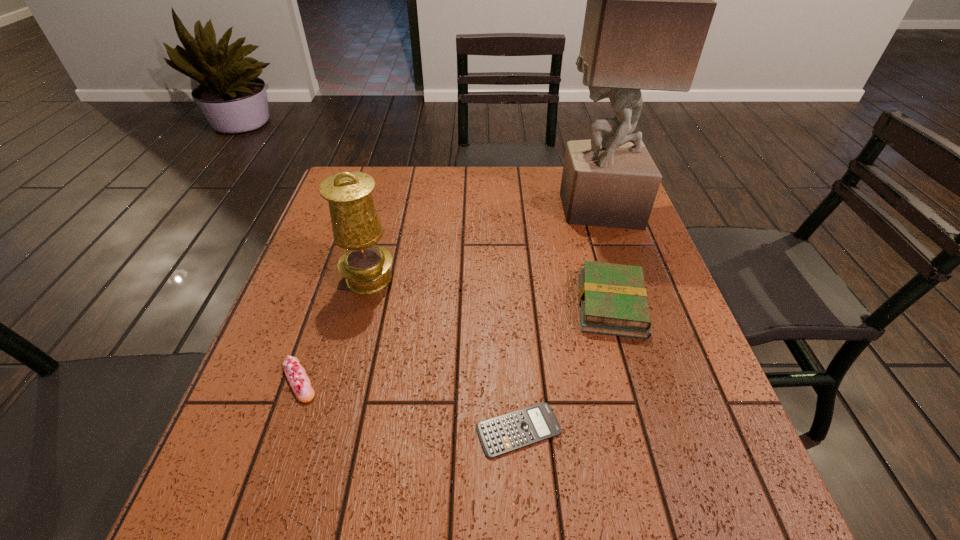
Find the location of a particular element. The width and height of the screenshot is (960, 540). sculpture is located at coordinates coord(650,5).

Where is `the farthest object`? This screenshot has height=540, width=960. the farthest object is located at coordinates (650, 5).

Image resolution: width=960 pixels, height=540 pixels. Identify the location of oil lamp. (356, 226).

The height and width of the screenshot is (540, 960). What are the coordinates of `the third tallest object` in the screenshot? It's located at (613, 300).

You are a GUI agent. You are given a task and a screenshot of the screen. Output one action in this format:
    pyautogui.click(x=<x>, y=<y>)
    Task: Click on the eclair
    
    Given the screenshot: What is the action you would take?
    pyautogui.click(x=300, y=383)

Find the location of a particular element. The width and height of the screenshot is (960, 540). the third object from left to right is located at coordinates (518, 429).

You are a GUI agent. You are given a task and a screenshot of the screen. Output one action in this format:
    pyautogui.click(x=<x>, y=<y>)
    Task: Click on the calculator
    
    Given the screenshot: What is the action you would take?
    pyautogui.click(x=518, y=429)

Identify the location of vacant area located on the front-facing side of the sculpture. [x=465, y=207].

You are a GUI agent. You are given a task and a screenshot of the screen. Output one action in this format:
    pyautogui.click(x=<x>, y=<y>)
    Task: Click on the free space located 0.320m on the front-facing side of the sculpture
    
    Given the screenshot: What is the action you would take?
    pyautogui.click(x=451, y=207)

Identify the location of free space located 0.230m on the front-facing side of the sculpture. This screenshot has width=960, height=540. (481, 207).